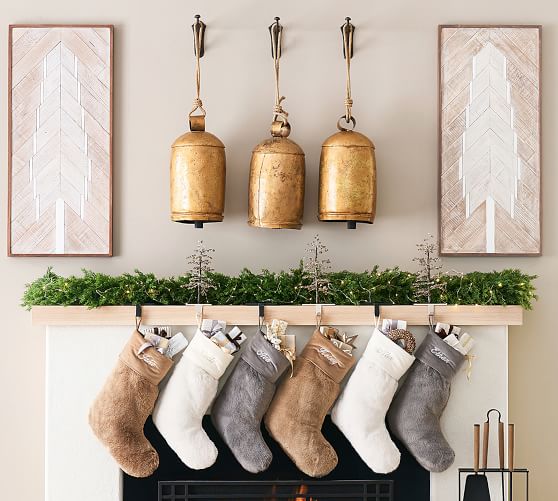
The width and height of the screenshot is (558, 501). What are the coordinates of `christmas stocking` in the screenshot? It's located at (113, 409), (190, 387), (258, 382), (321, 385), (372, 386), (432, 386).